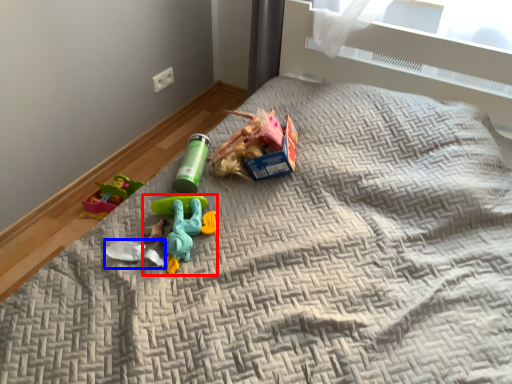
Question: Which object is closer to the camera taking this photo, toy (highlighted by a red box) or toy (highlighted by a blue box)?

Choices:
 (A) toy
 (B) toy

Answer: (A)